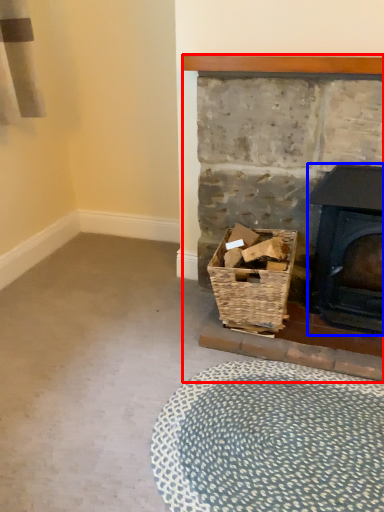
Question: Which object is closer to the camera taking this photo, fireplace (highlighted by a red box) or wood burning stove (highlighted by a blue box)?

Choices:
 (A) fireplace
 (B) wood burning stove

Answer: (A)